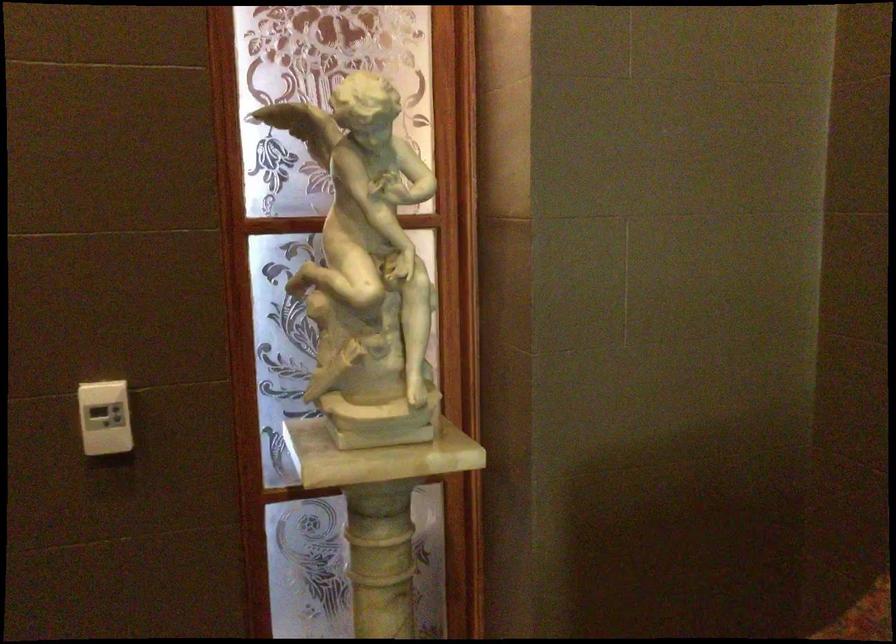
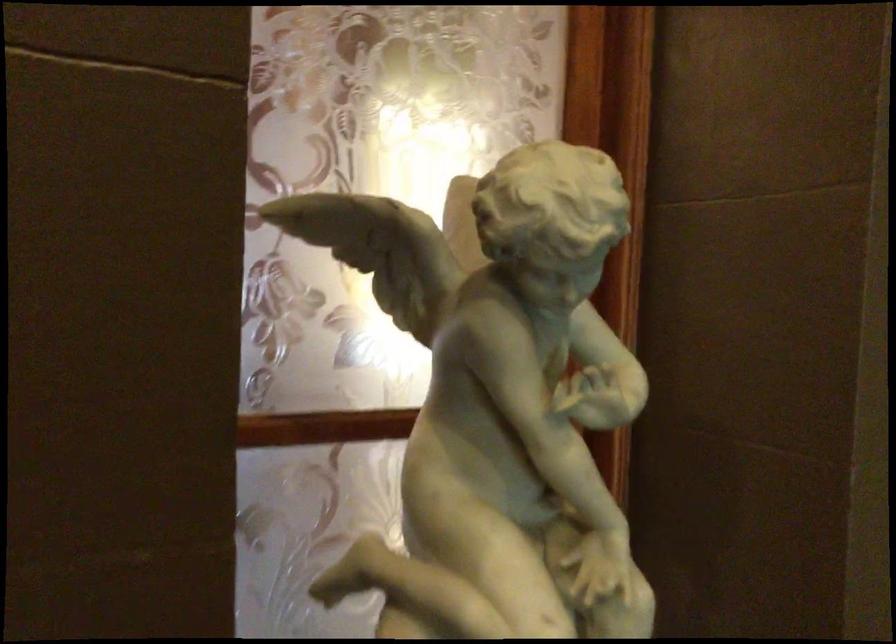
Which direction would the cameraman need to move to produce the second image?

The cameraman moved toward left, forward.